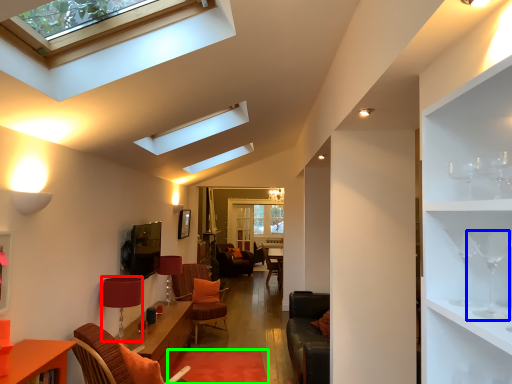
Question: Based on their relative distances, which object is farther from lamp (highlighted by a red box)? Choose from wine glass (highlighted by a blue box) and plain (highlighted by a green box).

Choices:
 (A) wine glass
 (B) plain

Answer: (A)